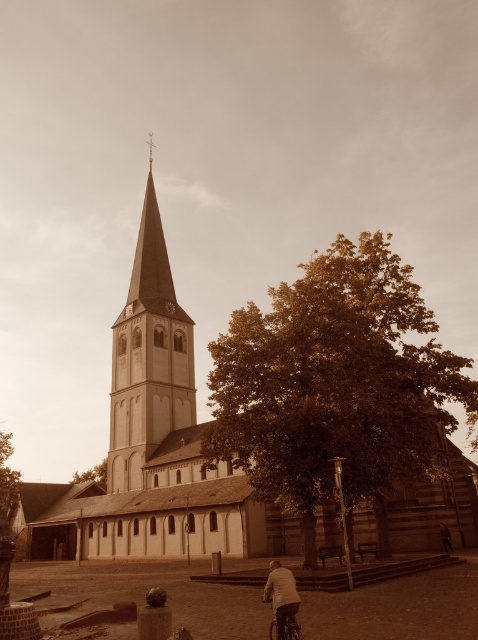
Question: Which point is farther to the camera?

Choices:
 (A) (86, 529)
 (B) (154, 332)
 (C) (286, 589)

Answer: (B)

Question: Is smooth stone spire at center further to the viewer compared to shiny metallic bicycle at lower center?

Choices:
 (A) no
 (B) yes

Answer: (B)

Question: Can you confirm if light beige stone church at center is smaller than shiny metallic bicycle at lower center?

Choices:
 (A) no
 (B) yes

Answer: (A)

Question: Among these points, which one is farthest from the camera?

Choices:
 (A) (110, 509)
 (B) (289, 612)
 (C) (151, 326)
 (D) (281, 636)

Answer: (C)

Question: In this image, where is smooth stone spire at center located relative to light brown leather jacket at lower right?

Choices:
 (A) right
 (B) left

Answer: (B)

Question: Estimate the real-world distances between objects in this image. Which object is closer to the shiny metallic bicycle at lower center?

Choices:
 (A) light beige stone church at center
 (B) light brown leather jacket at lower right
 (C) smooth stone spire at center

Answer: (B)